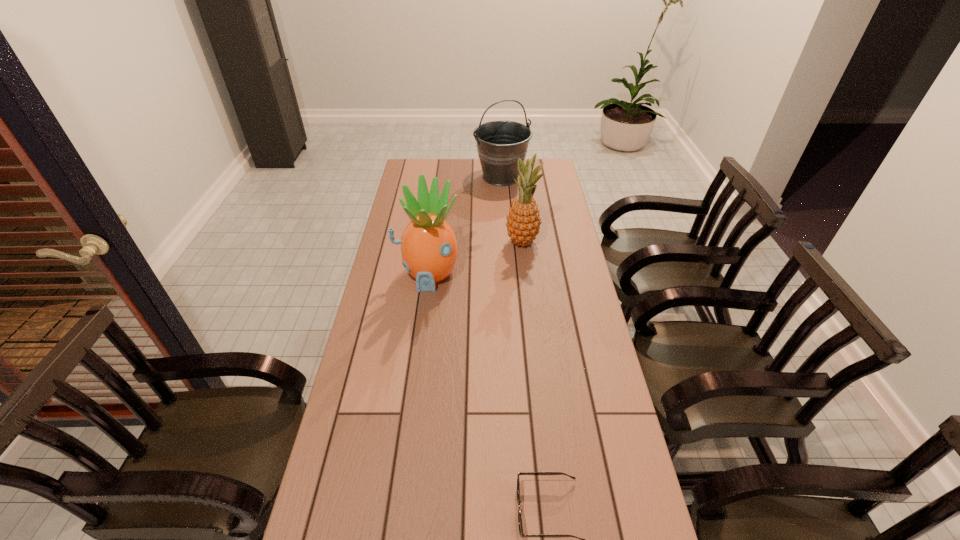
Identify the location of bucket at the right edge. This screenshot has width=960, height=540. (500, 143).

In order to click on pineapple that is positioned at the right edge in this screenshot , I will do `click(523, 223)`.

In order to click on object that is at the far right corner in this screenshot , I will do `click(500, 143)`.

Find the location of a particular element. This screenshot has width=960, height=540. free space at the far edge of the desktop is located at coordinates (463, 179).

You are a GUI agent. You are given a task and a screenshot of the screen. Output one action in this format:
    pyautogui.click(x=<x>, y=<y>)
    Task: Click on the free space at the left edge of the desktop
    This screenshot has height=540, width=960.
    Given the screenshot: What is the action you would take?
    pyautogui.click(x=396, y=233)

This screenshot has width=960, height=540. What are the coordinates of `free space at the right edge` in the screenshot? It's located at (558, 185).

Locate an element on the screen. The image size is (960, 540). free spot between the bucket and the nearer pineapple is located at coordinates (465, 226).

This screenshot has width=960, height=540. What are the coordinates of `free space that is in between the farther pineapple and the second nearest object` in the screenshot? It's located at (475, 258).

Locate an element on the screen. The width and height of the screenshot is (960, 540). vacant space that's between the second nearest object and the farther pineapple is located at coordinates coord(475,258).

Select which object appears as the closest to the nearer pineapple. Please provide its 2D coordinates. Your answer should be formatted as a tuple, i.e. [(x, y)], where the tuple contains the x and y coordinates of a point satisfying the conditions above.

[(523, 223)]